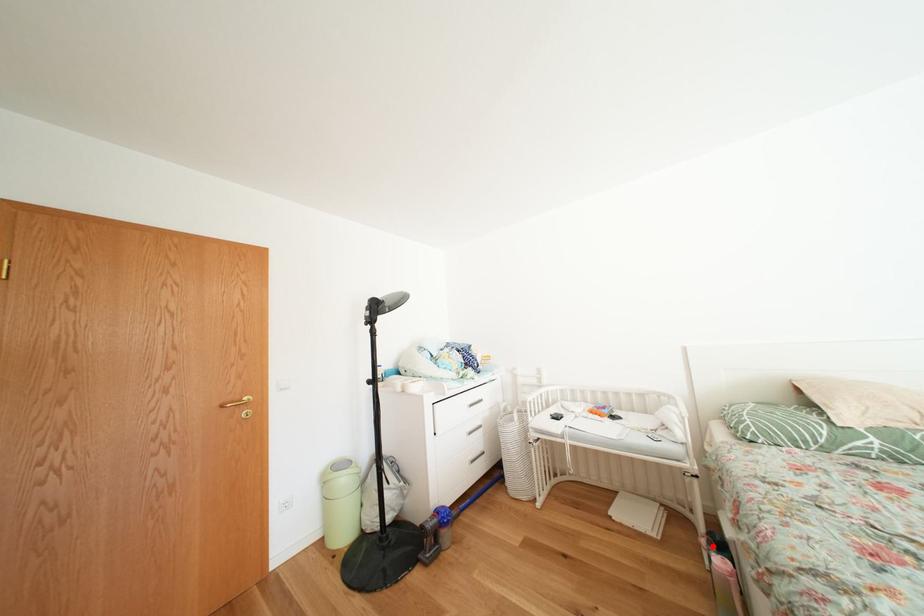
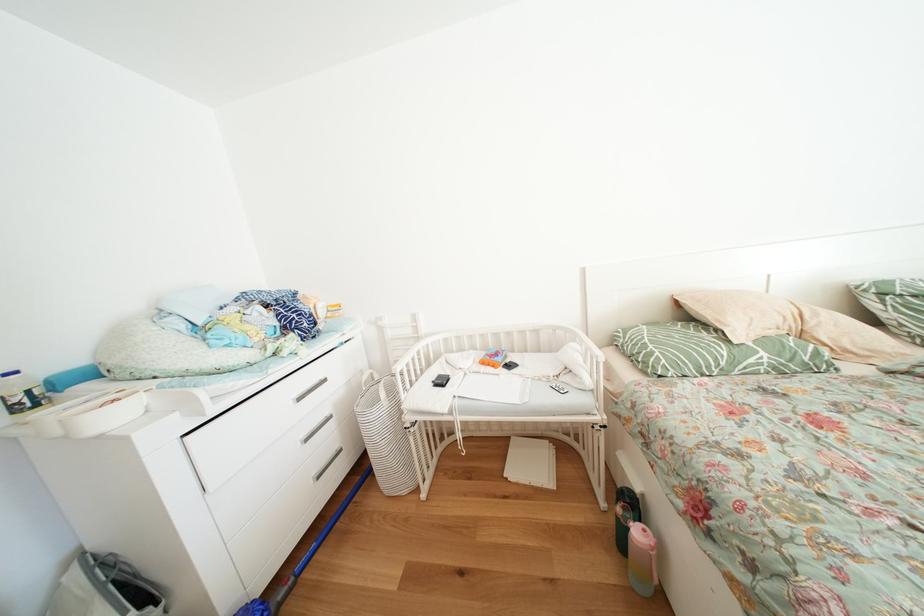
The point at the highlighted location is marked in the first image. Where is the corresponding point in the second image?

(628, 515)